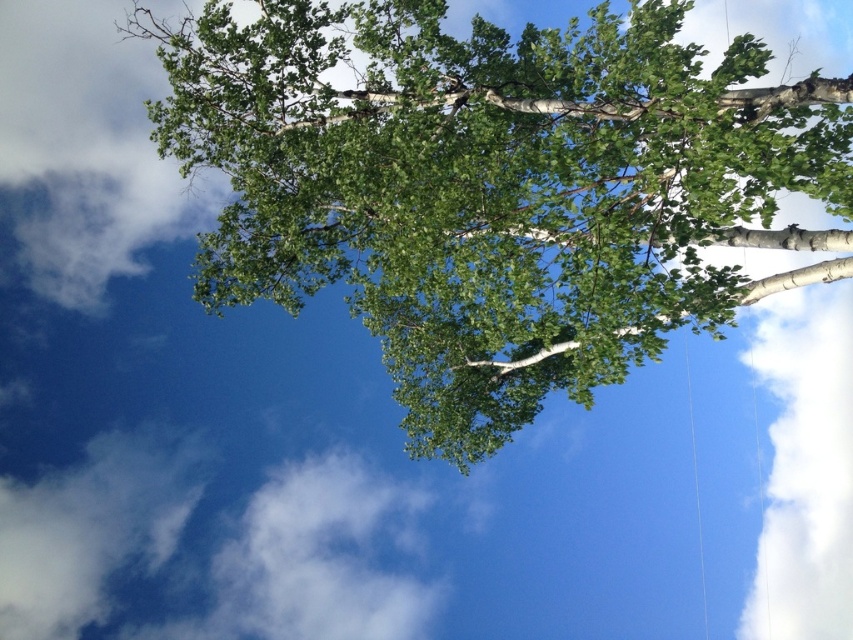
How far apart are white fluffy cloud at upper right and white fluffy cloud at lower left?

They are 51.22 feet apart.

Looking at this image, does white fluffy cloud at upper right have a larger size compared to white fluffy cloud at lower left?

Actually, white fluffy cloud at upper right might be smaller than white fluffy cloud at lower left.

Does point (799, 444) lie in front of point (155, 483)?

That is False.

Locate an element on the screen. white fluffy cloud at upper right is located at coordinates (805, 468).

Which of these two, green leafy tree at upper center or white fluffy cloud at lower left, stands taller?

With more height is green leafy tree at upper center.

Is point (782, 170) positioned after point (4, 572)?

That is False.

Does point (469, 54) lie behind point (144, 472)?

No, (469, 54) is closer to viewer.

Identify the location of green leafy tree at upper center. This screenshot has height=640, width=853. (495, 189).

Can you confirm if green leafy tree at upper center is thinner than white fluffy cloud at upper right?

In fact, green leafy tree at upper center might be wider than white fluffy cloud at upper right.

Is green leafy tree at upper center to the left of white fluffy cloud at upper right from the viewer's perspective?

Indeed, green leafy tree at upper center is positioned on the left side of white fluffy cloud at upper right.

Measure the distance between point (775, 99) and camera.

Point (775, 99) is 11.19 meters from camera.

The width and height of the screenshot is (853, 640). What are the coordinates of `green leafy tree at upper center` in the screenshot? It's located at (495, 189).